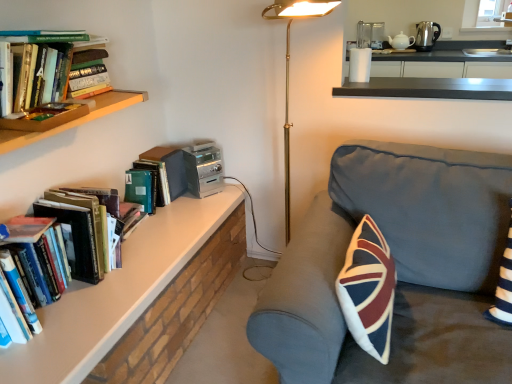
Where is `vacant area that is situated to the right of hardcover books at left, the third book from the back`? Image resolution: width=512 pixels, height=384 pixels. vacant area that is situated to the right of hardcover books at left, the third book from the back is located at coordinates click(135, 283).